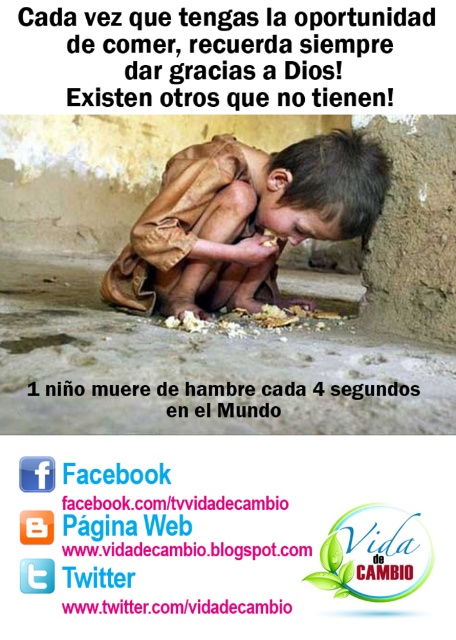
Which is in front, point (165, 289) or point (217, 326)?

Point (217, 326) is in front.

Does brown rough cloth at center appear over white crumbly bread at center?

Indeed, brown rough cloth at center is positioned over white crumbly bread at center.

Does point (113, 292) lie behind point (265, 316)?

Yes, it is.

Identify the location of brown rough cloth at center. (243, 220).